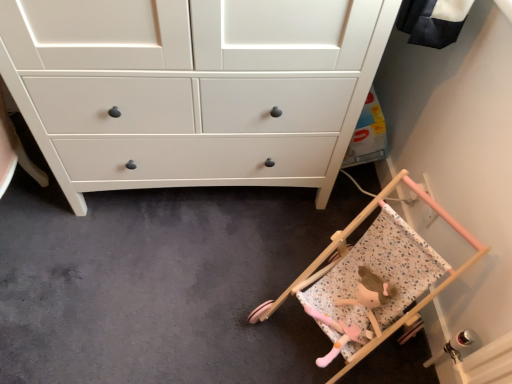
Locate an element on the screen. Image resolution: width=512 pixels, height=384 pixels. vacant region to the left of wooden baby carriage at lower right is located at coordinates (209, 299).